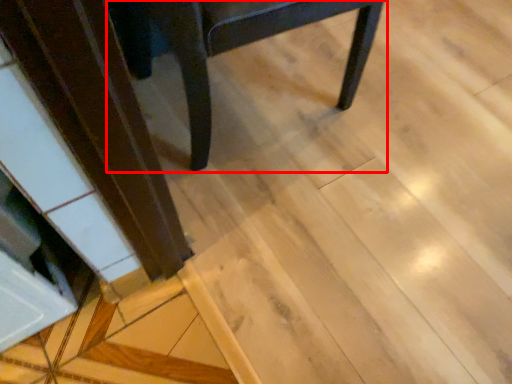
Question: In this image, where is chair (annotated by the red box) located relative to wood?

Choices:
 (A) right
 (B) left

Answer: (A)